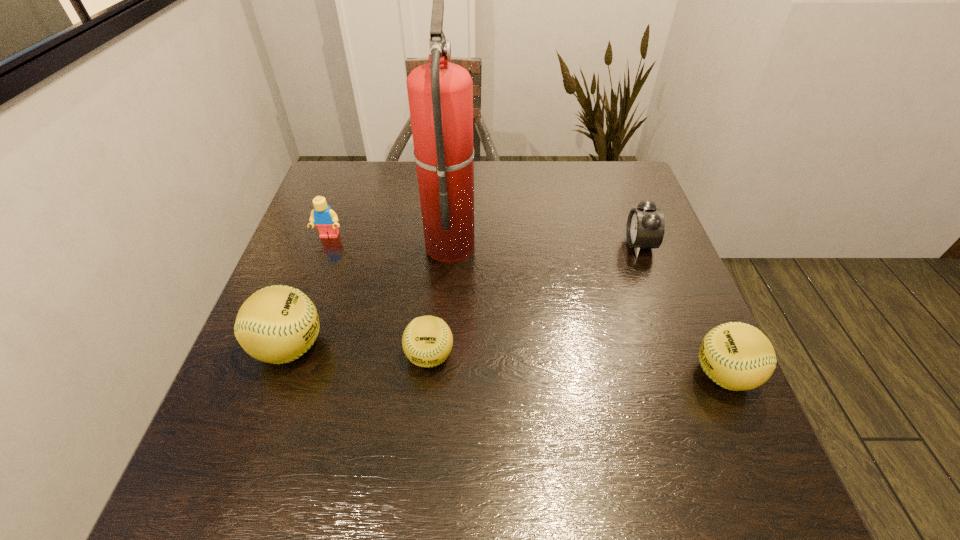
Identify which softball is the third closest to the tallest object. Please provide its 2D coordinates. Your answer should be formatted as a tuple, i.e. [(x, y)], where the tuple contains the x and y coordinates of a point satisfying the conditions above.

[(737, 356)]

I want to click on blank space that satisfies the following two spatial constraints: 1. with the nozzle and gauge on the fire extinguisher; 2. on the logo side of the second softball from left to right, so click(x=442, y=356).

Identify the location of vacant space that satisfies the following two spatial constraints: 1. with the nozzle and gauge on the tallest object; 2. on the logo side of the shortest softball. This screenshot has height=540, width=960. (442, 356).